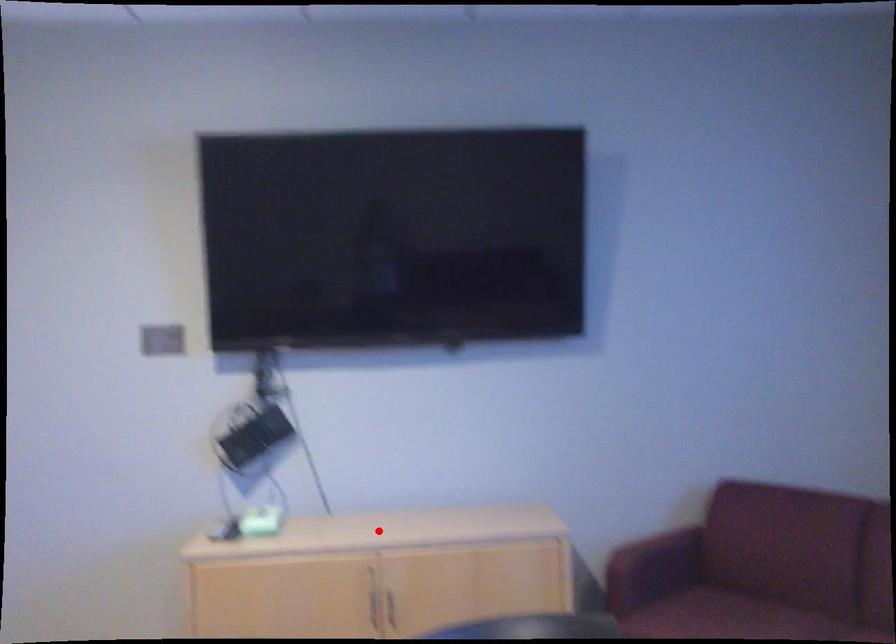
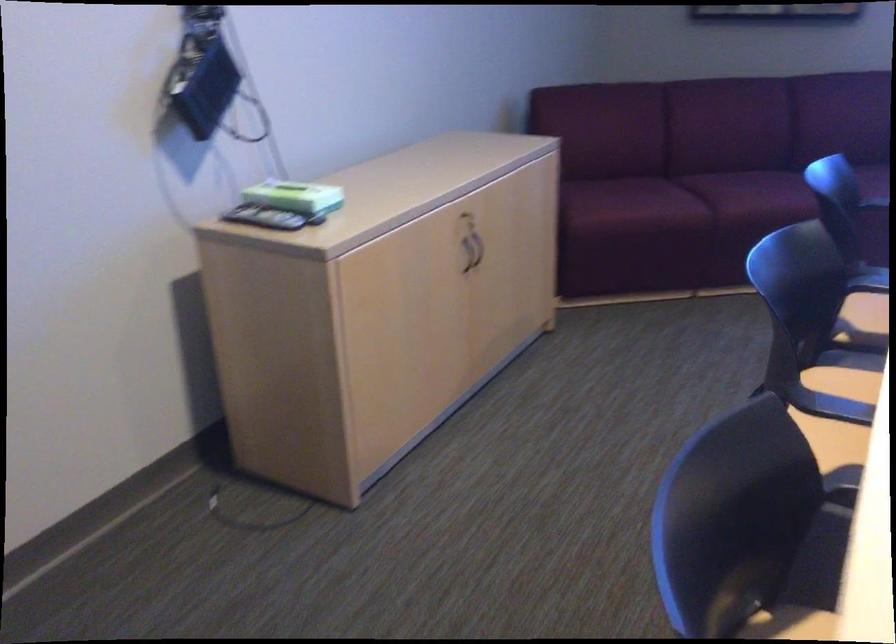
In the second image, find the point that corresponds to the highlighted location in the first image.

(428, 175)